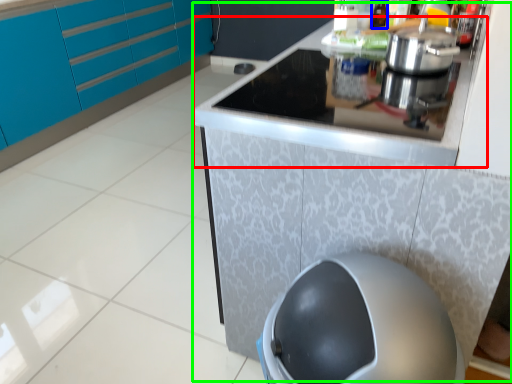
Question: Considering the real-world distances, which object is closest to counter top (highlighted by a red box)? bottle (highlighted by a blue box) or counter (highlighted by a green box).

Choices:
 (A) bottle
 (B) counter

Answer: (B)